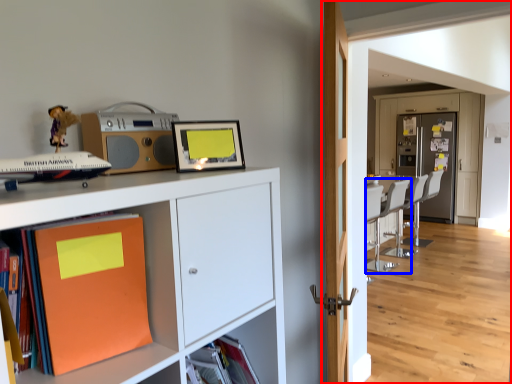
Question: Which object appears closest to the camera in this image, corridor (highlighted by a red box) or chair (highlighted by a blue box)?

Choices:
 (A) corridor
 (B) chair

Answer: (A)